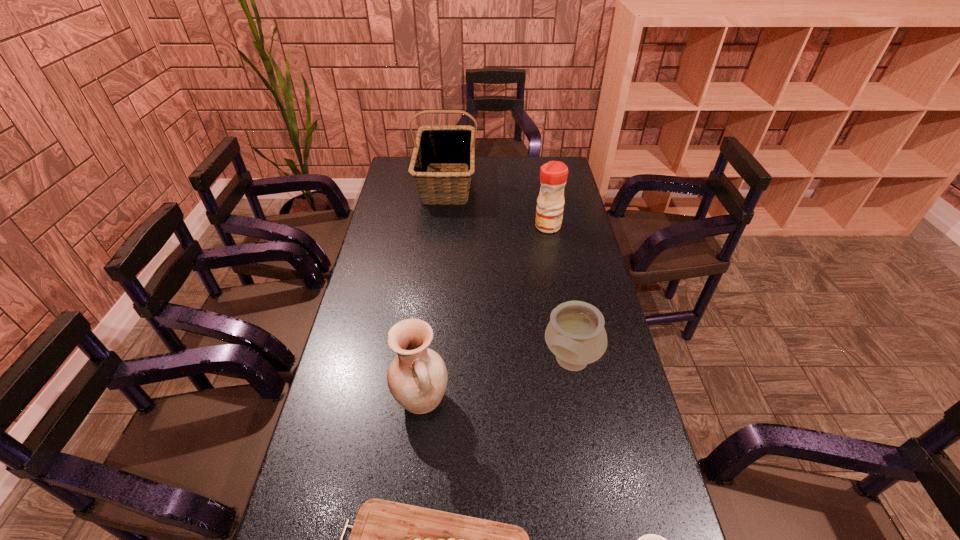
Where is `object located in the far edge section of the desktop`? The image size is (960, 540). object located in the far edge section of the desktop is located at coordinates (437, 145).

At what (x,y) coordinates should I click in order to perform the action: click on object that is at the left edge. Please return your answer as a coordinate pair (x, y). This screenshot has width=960, height=540. Looking at the image, I should click on (437, 145).

I want to click on condiment that is at the right edge, so click(553, 175).

At what (x,y) coordinates should I click in order to perform the action: click on pottery positioned at the right edge. Please return your answer as a coordinate pair (x, y). The image size is (960, 540). Looking at the image, I should click on [575, 334].

This screenshot has height=540, width=960. Identify the location of object situated at the far left corner. (437, 145).

Where is `free space at the far edge of the desktop`? The width and height of the screenshot is (960, 540). free space at the far edge of the desktop is located at coordinates click(528, 158).

Find the location of a particular element. This screenshot has width=960, height=540. free spot at the left edge of the desktop is located at coordinates (384, 191).

Identify the location of vacant space at the right edge of the desktop. This screenshot has width=960, height=540. (565, 228).

Where is `vacant area at the far left corner of the desktop`? vacant area at the far left corner of the desktop is located at coordinates (401, 173).

Find the location of `vacant region between the basket and the right pottery`. vacant region between the basket and the right pottery is located at coordinates (509, 273).